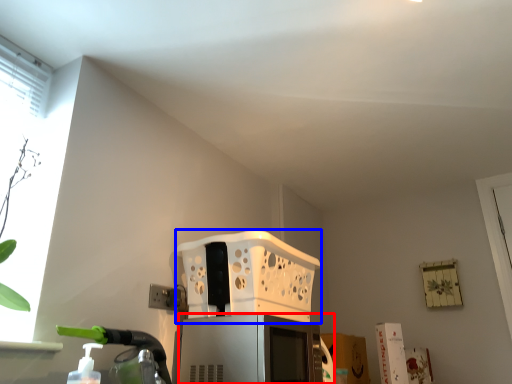
Question: Which of the following is the farthest to the observer, appliance (highlighted by a red box) or basket (highlighted by a blue box)?

Choices:
 (A) appliance
 (B) basket

Answer: (B)